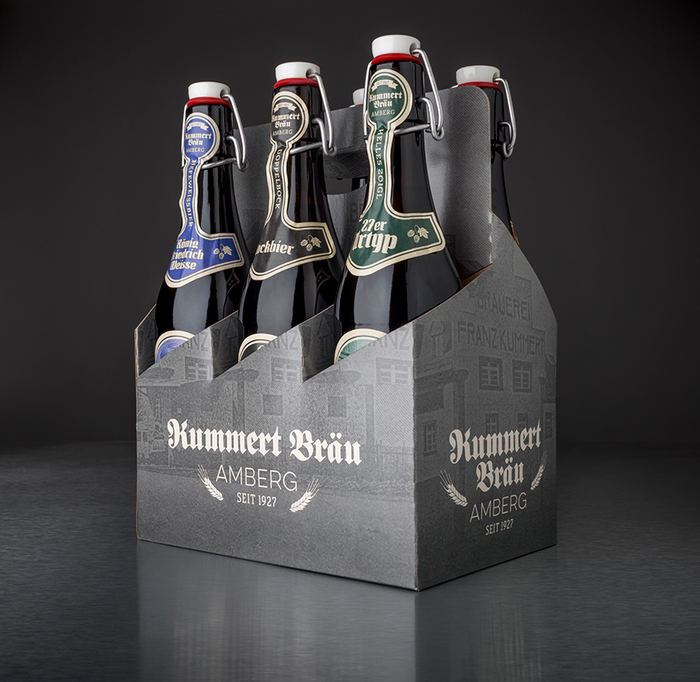
Locate an element on the screen. The image size is (700, 682). leftmost bottle is located at coordinates (183, 305).